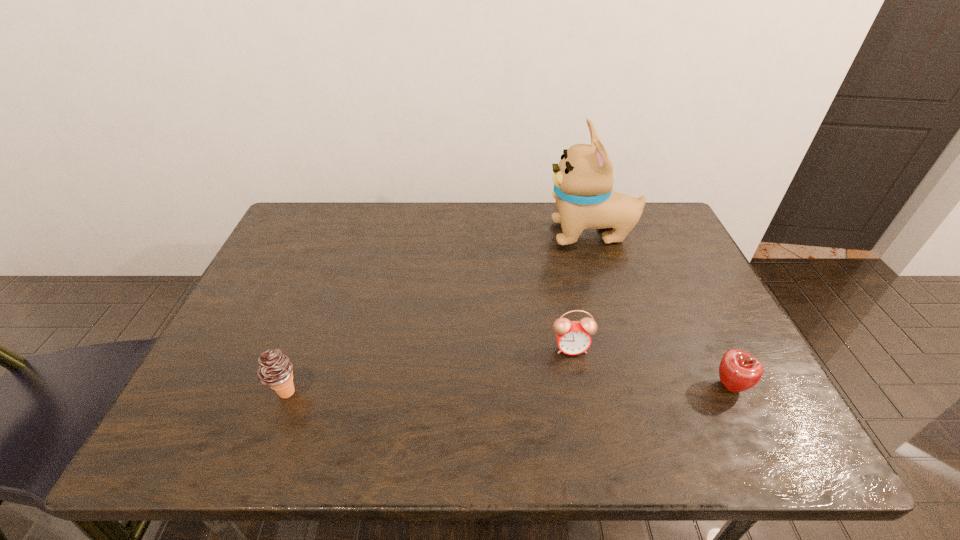
Locate an element on the screen. vacant space situated 0.310m on the face of the tallest object is located at coordinates (444, 234).

Locate an element on the screen. The image size is (960, 540). vacant region located 0.130m on the back of the third shortest object is located at coordinates (308, 333).

This screenshot has height=540, width=960. I want to click on vacant space situated 0.060m on the clock face of the alarm clock, so click(577, 378).

Where is `vacant area located 0.270m on the left of the shortest object`? The image size is (960, 540). vacant area located 0.270m on the left of the shortest object is located at coordinates (587, 387).

I want to click on object that is positioned at the far edge, so click(583, 180).

Where is `puppy present at the right edge`? This screenshot has width=960, height=540. puppy present at the right edge is located at coordinates (583, 180).

At what (x,y) coordinates should I click in order to perform the action: click on apple that is positioned at the right edge. Please return your answer as a coordinate pair (x, y). This screenshot has width=960, height=540. Looking at the image, I should click on (738, 370).

At what (x,y) coordinates should I click in order to perform the action: click on object situated at the far right corner. Please return your answer as a coordinate pair (x, y). Looking at the image, I should click on (583, 180).

Locate an element on the screen. Image resolution: width=960 pixels, height=540 pixels. vacant space at the far edge is located at coordinates coord(383,219).

In the image, there is a desktop. Identify the location of vacant space at the near edge. (388, 424).